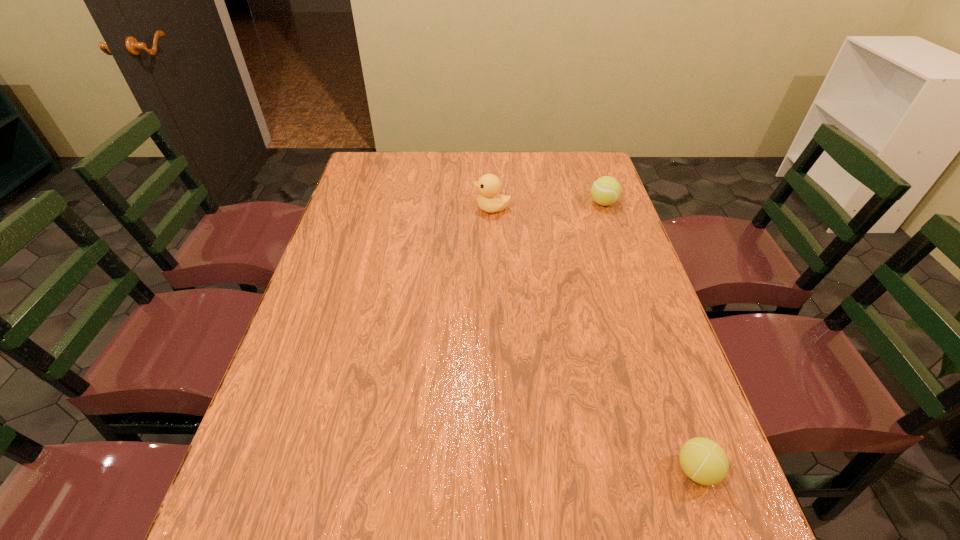
At what (x,y) coordinates should I click in order to perform the action: click on duck. Please return your answer as a coordinate pair (x, y). The image size is (960, 540). Looking at the image, I should click on (489, 185).

You are a GUI agent. You are given a task and a screenshot of the screen. Output one action in this format:
    pyautogui.click(x=<x>, y=<y>)
    Task: Click on the tallest object
    Image resolution: width=960 pixels, height=540 pixels.
    Given the screenshot: What is the action you would take?
    pyautogui.click(x=489, y=185)

Where is `the second shortest object`? This screenshot has width=960, height=540. the second shortest object is located at coordinates (606, 190).

This screenshot has width=960, height=540. Identify the location of the taller tennis ball. (606, 190).

The height and width of the screenshot is (540, 960). What are the coordinates of `the nearer tennis ball` in the screenshot? It's located at (705, 462).

Identify the location of the shortest object. This screenshot has width=960, height=540. (705, 462).

At what (x,y) coordinates should I click in order to perform the action: click on free region located 0.330m on the face of the leftmost object. Please return your answer as a coordinate pair (x, y). Image resolution: width=960 pixels, height=540 pixels. Looking at the image, I should click on (372, 208).

Where is `blank space located on the face of the leftmost object`? blank space located on the face of the leftmost object is located at coordinates (455, 208).

This screenshot has width=960, height=540. I want to click on vacant space located on the face of the leftmost object, so click(x=412, y=208).

Where is `vacant space located on the back of the farther tennis ball`? Image resolution: width=960 pixels, height=540 pixels. vacant space located on the back of the farther tennis ball is located at coordinates pos(587,156).